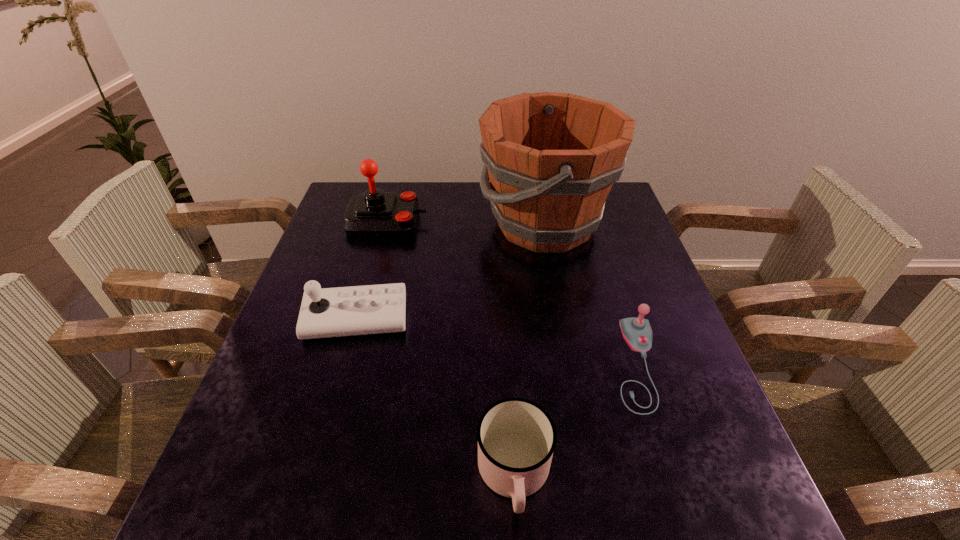
I want to click on the tallest object, so click(551, 158).

You are a GUI agent. You are given a task and a screenshot of the screen. Output one action in this format:
    pyautogui.click(x=<x>, y=<y>)
    Task: Click on the tallest joystick
    This screenshot has height=540, width=960.
    Given the screenshot: What is the action you would take?
    pyautogui.click(x=373, y=213)

Identify the location of the farthest joystick. (373, 213).

Where is `the second tallest joystick`? This screenshot has height=540, width=960. the second tallest joystick is located at coordinates click(x=371, y=309).

Identify the location of the nearest object. This screenshot has width=960, height=540. (516, 437).

Find the location of a particular element. The height and width of the screenshot is (540, 960). the shortest joystick is located at coordinates (637, 332).

This screenshot has height=540, width=960. Find the location of `vacant region located 0.060m on the handle side of the tallest object`. vacant region located 0.060m on the handle side of the tallest object is located at coordinates (459, 225).

Locate an element on the screen. vacant area located 0.370m on the handle side of the tallest object is located at coordinates (356, 225).

This screenshot has height=540, width=960. What are the coordinates of `free region located on the handle side of the tallest object` in the screenshot? It's located at (396, 225).

This screenshot has height=540, width=960. In order to click on vacant area located 0.110m on the base of the tallest joystick in this screenshot , I will do `click(463, 221)`.